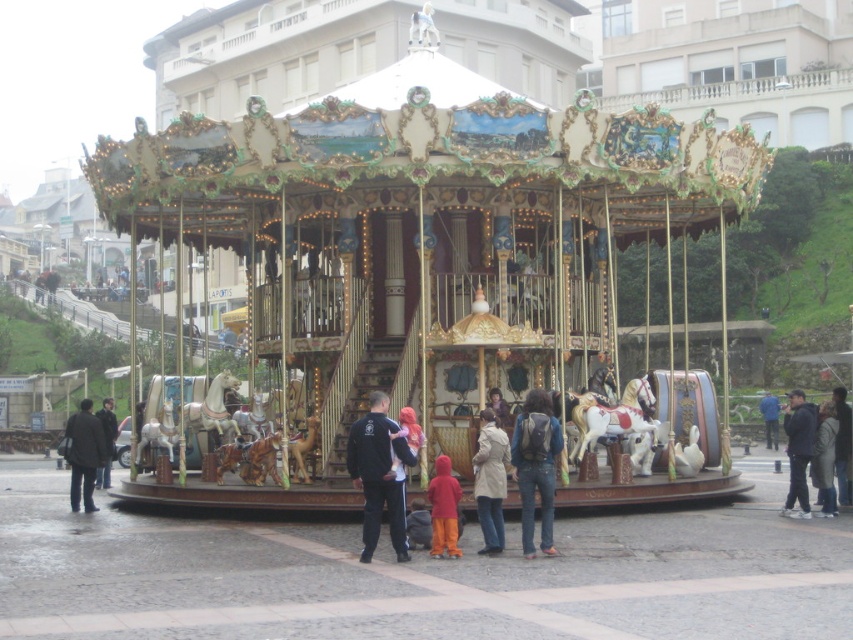
Between light beige coat at center and light brown leather jacket at center, which one has more height?

light brown leather jacket at center

Which is above, light beige coat at center or light brown leather jacket at center?

light brown leather jacket at center is higher up.

You are a GUI agent. You are given a task and a screenshot of the screen. Output one action in this format:
    pyautogui.click(x=<x>, y=<y>)
    Task: Click on the light beige coat at center
    This screenshot has width=853, height=640.
    Given the screenshot: What is the action you would take?
    pyautogui.click(x=490, y=481)

Between light beige coat at center and dark blue jeans at center, which one has less height?

light beige coat at center

Is point (482, 476) more distant than point (844, 474)?

No, (482, 476) is in front of (844, 474).

Image resolution: width=853 pixels, height=640 pixels. Identify the location of light beige coat at center. (490, 481).

Describe the element at coordinates (416, 244) in the screenshot. This screenshot has width=853, height=640. I see `gold/ornate carousel at center` at that location.

Is point (347, 164) positioned after point (798, 400)?

No, (347, 164) is closer to viewer.

Is point (494, 228) positioned in front of point (788, 424)?

No, it is behind (788, 424).

Image resolution: width=853 pixels, height=640 pixels. Find the location of `gold/ornate carousel at center`. gold/ornate carousel at center is located at coordinates (416, 244).